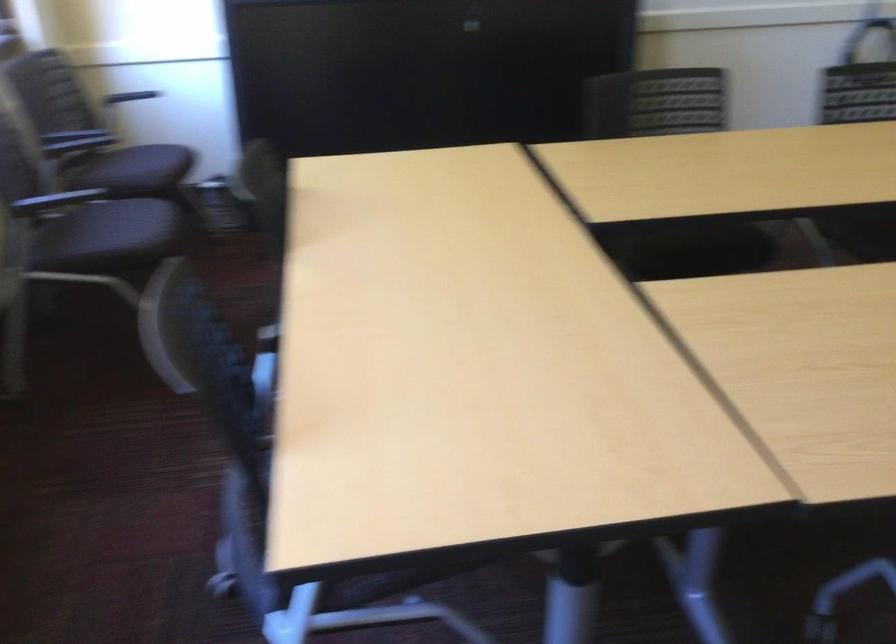
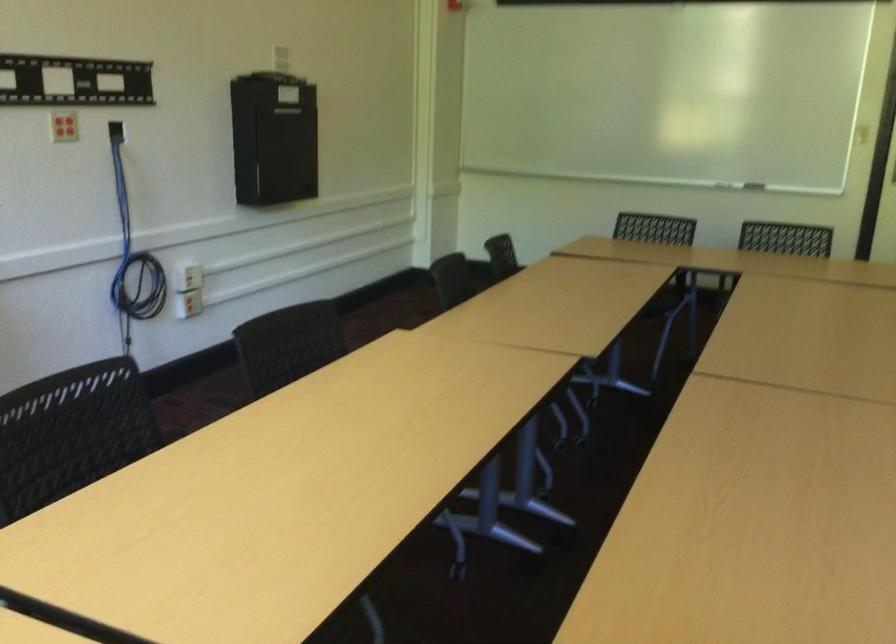
Locate, in the second image, the point that corresponds to point (643, 108) in the first image.

(71, 433)